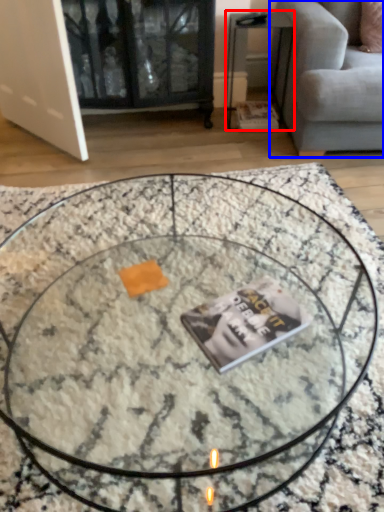
Question: Which point is further to the camera, side table (highlighted by a red box) or studio couch (highlighted by a blue box)?

Choices:
 (A) side table
 (B) studio couch

Answer: (A)